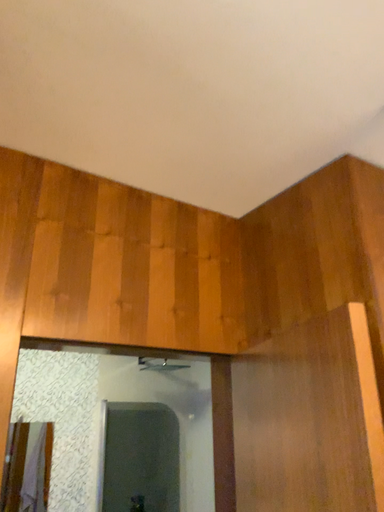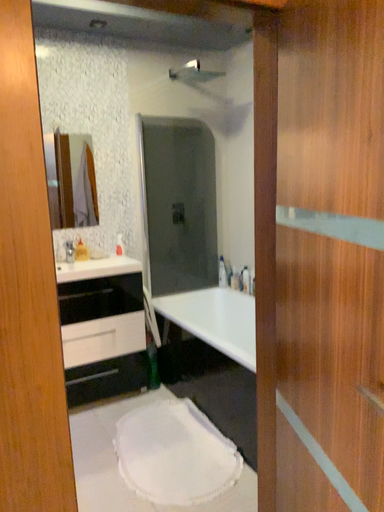
Question: How did the camera likely rotate when shooting the video?

Choices:
 (A) rotated downward
 (B) rotated upward

Answer: (A)